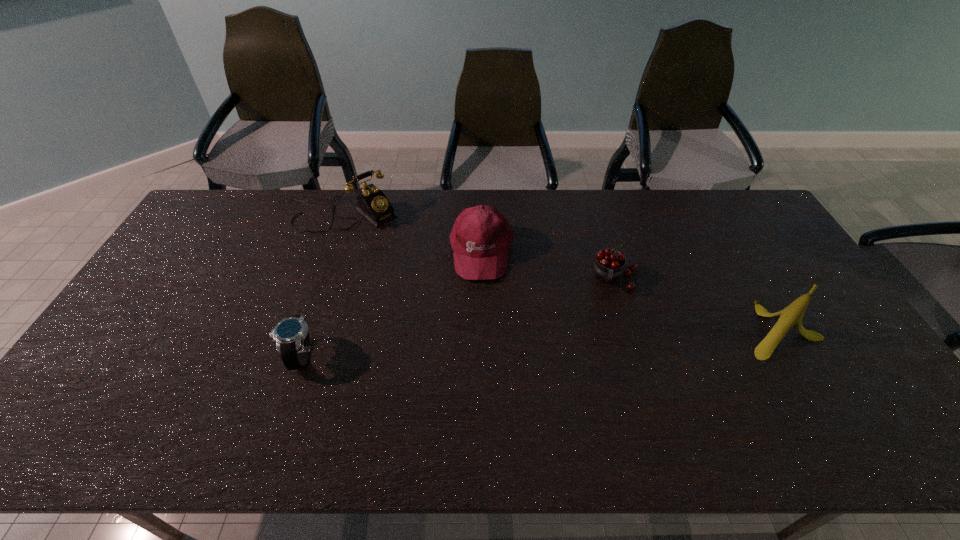
The image size is (960, 540). What are the coordinates of `blank area at the far edge` in the screenshot? It's located at (426, 222).

This screenshot has height=540, width=960. I want to click on blank space at the near edge of the desktop, so click(787, 391).

Image resolution: width=960 pixels, height=540 pixels. What are the coordinates of `vacant space at the left edge of the desktop` in the screenshot? It's located at (190, 240).

The width and height of the screenshot is (960, 540). I want to click on vacant area at the right edge of the desktop, so point(792,284).

Locate an element on the screen. vacant space at the far left corner is located at coordinates (224, 201).

Locate an element on the screen. vacant space at the far right corner of the desktop is located at coordinates (767, 227).

Locate an element on the screen. vacant area that lies between the fourth object from left to right and the third object from left to right is located at coordinates (548, 264).

Find the location of a particular element. vacant area that lies between the banana and the telephone is located at coordinates (564, 272).

This screenshot has height=540, width=960. Identify the location of free area in between the pot filled with cherries and the shortest object. (457, 316).

The image size is (960, 540). I want to click on vacant space in between the fourth object from left to right and the shortest object, so click(x=457, y=316).